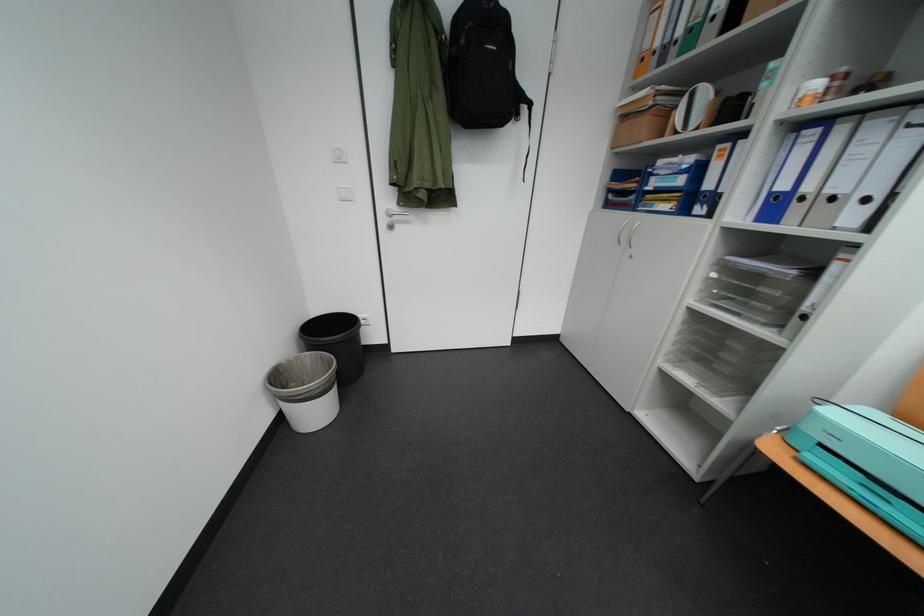
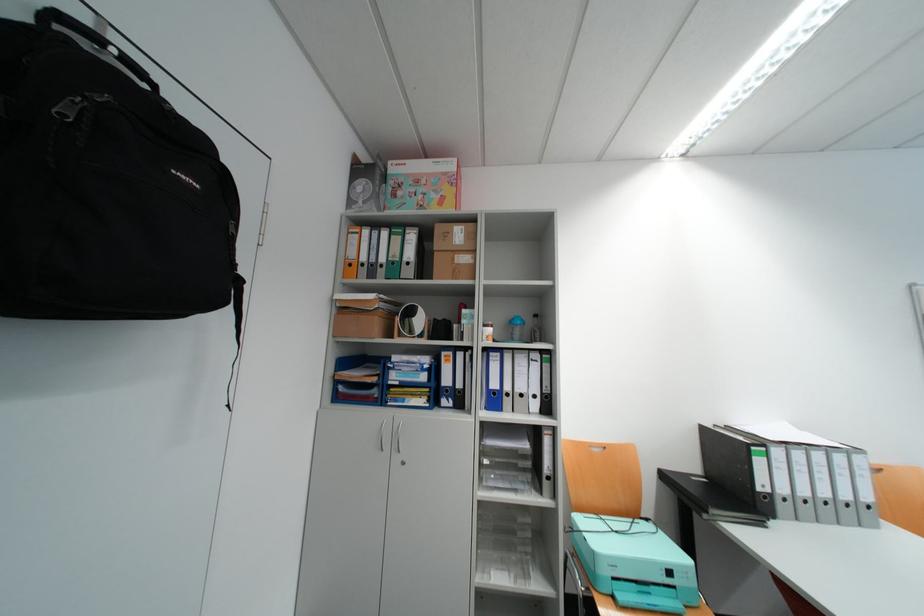
Locate, in the second image, the point that corresponds to the point at 849,435 in the first image.

(624, 562)